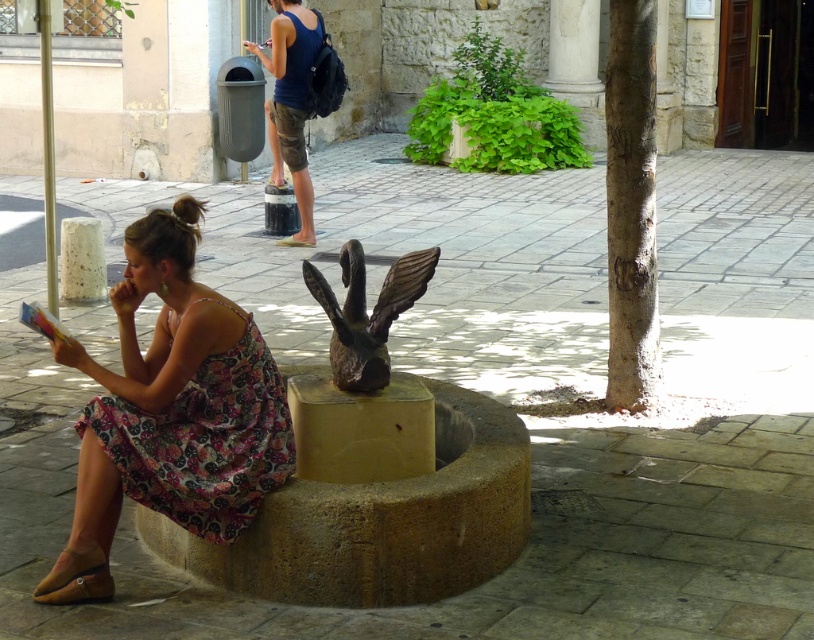
Is the position of bronze statue at center more distant than that of matte blue tank top at upper center?

No, bronze statue at center is closer to the viewer.

Image resolution: width=814 pixels, height=640 pixels. I want to click on bronze statue at center, so click(x=365, y=312).

Image resolution: width=814 pixels, height=640 pixels. In order to click on bronze statue at center in this screenshot , I will do `click(365, 312)`.

The image size is (814, 640). Find the location of `bronze statue at center`. bronze statue at center is located at coordinates (365, 312).

Does floral print fabric dress at lower left appear under bronze statue at center?

Yes, floral print fabric dress at lower left is below bronze statue at center.

The height and width of the screenshot is (640, 814). Describe the element at coordinates (204, 442) in the screenshot. I see `floral print fabric dress at lower left` at that location.

Find the location of a particular element. Image resolution: width=814 pixels, height=640 pixels. floral print fabric dress at lower left is located at coordinates (204, 442).

Based on the photo, who is taller, floral print fabric dress at lower left or matte blue tank top at upper center?

With more height is matte blue tank top at upper center.

Does point (213, 410) lie in front of point (304, 32)?

Yes.

Find the location of `floral print fabric dress at lower left`. floral print fabric dress at lower left is located at coordinates (204, 442).